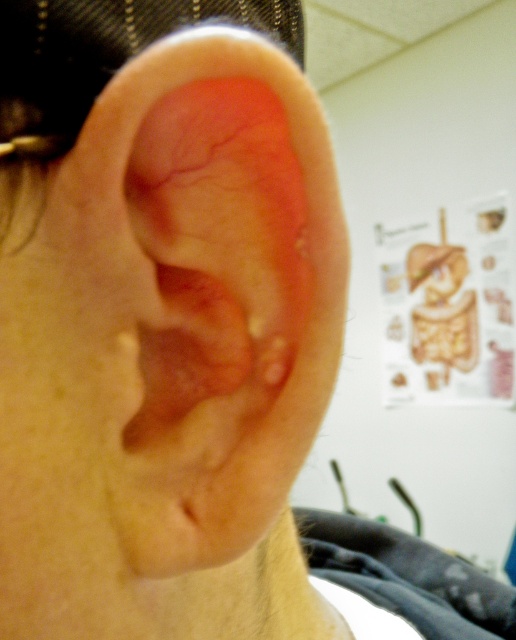
Question: Which of the following is the farthest from the observer?

Choices:
 (A) pink flesh-colored ear at center
 (B) matte skin forehead at upper center

Answer: (B)

Question: Among these objects, which one is nearest to the camera?

Choices:
 (A) matte skin forehead at upper center
 (B) pink flesh-colored ear at center
 (C) pink flesh at center

Answer: (B)

Question: Does pink flesh-colored ear at center have a lesser width compared to pink flesh at center?

Choices:
 (A) yes
 (B) no

Answer: (B)

Question: Does pink flesh-colored ear at center have a lesser width compared to matte skin forehead at upper center?

Choices:
 (A) no
 (B) yes

Answer: (B)

Question: Which of these objects is positioned farthest from the pink flesh at center?

Choices:
 (A) pink flesh-colored ear at center
 (B) matte skin forehead at upper center

Answer: (B)

Question: Is pink flesh-colored ear at center further to the viewer compared to matte skin forehead at upper center?

Choices:
 (A) yes
 (B) no

Answer: (B)